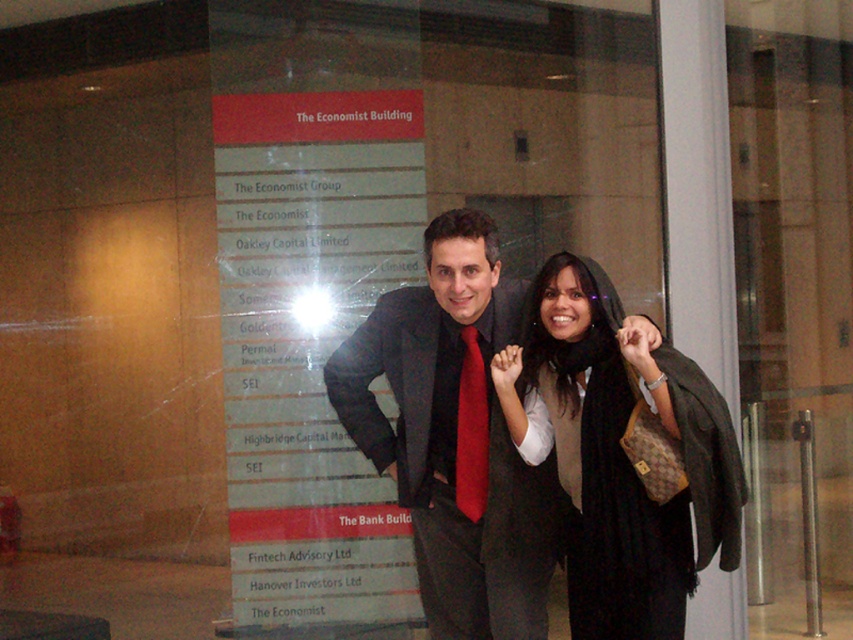
Question: Which of the following is the farthest from the observer?

Choices:
 (A) black fabric scarf at center
 (B) matte black suit at center
 (C) metallic signboard at center

Answer: (C)

Question: Estimate the real-world distances between objects in this image. Which object is closer to the black fabric scarf at center?

Choices:
 (A) metallic signboard at center
 (B) matte black suit at center

Answer: (B)

Question: Which point is farther from the camera taking this photo?

Choices:
 (A) (223, 224)
 (B) (674, 605)
 (C) (448, 525)

Answer: (A)

Question: Is black fabric scarf at center bigger than matte black suit at center?

Choices:
 (A) yes
 (B) no

Answer: (A)

Question: Can you confirm if black fabric scarf at center is thinner than matte black suit at center?

Choices:
 (A) no
 (B) yes

Answer: (B)

Question: Does metallic signboard at center have a smaller size compared to black fabric scarf at center?

Choices:
 (A) no
 (B) yes

Answer: (B)